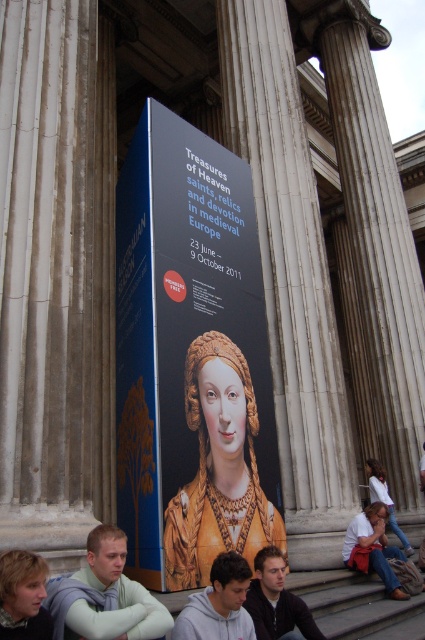
You are an artist trying to sketch the scene. You notice the matte gold necklace at lower center and the white cotton shirt at lower right. Which object should you draw first if you want to focus on the smaller one first?

The matte gold necklace at lower center should be drawn first because its width is less than the white cotton shirt at lower right, making it the smaller object.